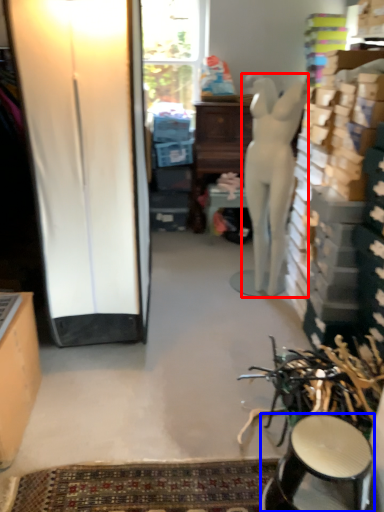
Question: Which of the following is the farthest to the observer, person (highlighted by a red box) or stool (highlighted by a blue box)?

Choices:
 (A) person
 (B) stool

Answer: (A)